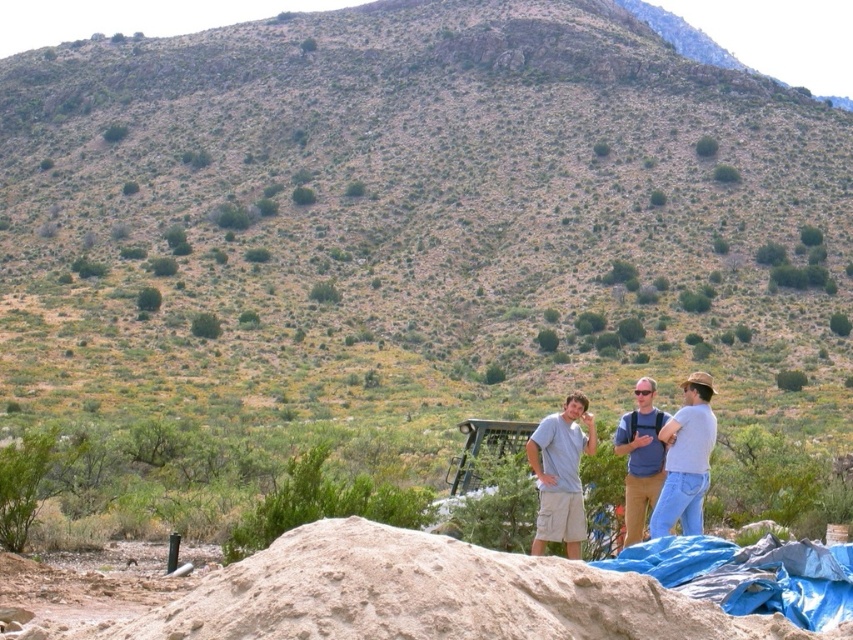
Question: Which point is closer to the camera taking this photo?

Choices:
 (A) (709, 424)
 (B) (566, 435)
 (C) (654, 428)

Answer: (A)

Question: Can you confirm if light blue jeans at center right is smaller than blue cotton shirt at center?

Choices:
 (A) no
 (B) yes

Answer: (B)

Question: Which point is farther to the camera?

Choices:
 (A) (178, 616)
 (B) (689, 394)

Answer: (B)

Question: Among these points, which one is nearest to the camera?

Choices:
 (A) (685, 468)
 (B) (621, 442)
 (C) (543, 444)
 (D) (531, 557)

Answer: (D)

Question: Can you confirm if smooth sand mound at lower center is positioned above blue cotton shirt at center?

Choices:
 (A) yes
 (B) no

Answer: (B)

Question: Can you confirm if light blue cotton shirt at center is wider than blue cotton shirt at center?

Choices:
 (A) no
 (B) yes

Answer: (A)